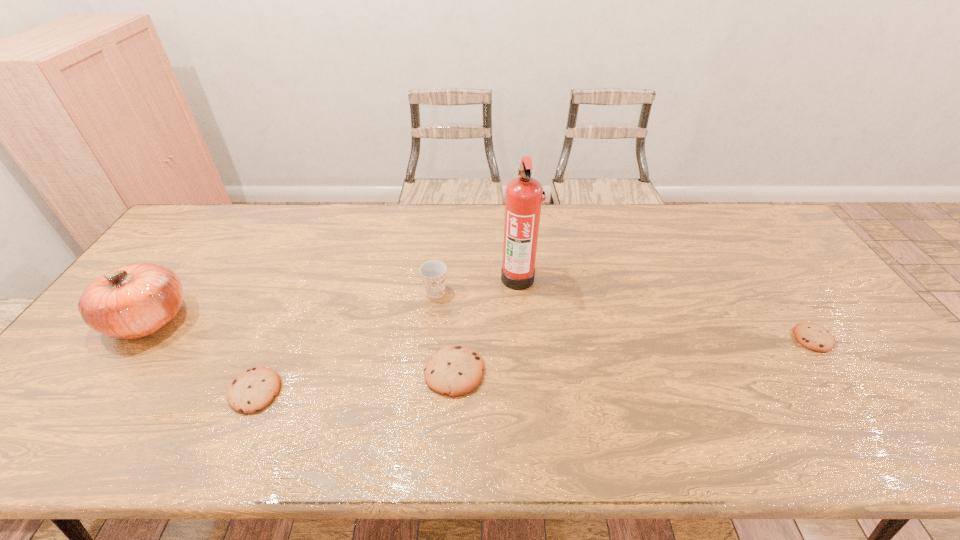
The height and width of the screenshot is (540, 960). What are the coordinates of `vacant space that's between the leftmost object and the second shortest cookie` in the screenshot? It's located at (202, 355).

Where is `unoccupied area between the pumpkin and the Dixie cup`? unoccupied area between the pumpkin and the Dixie cup is located at coordinates (292, 306).

Where is `free space between the second tallest cookie and the tallest object`? free space between the second tallest cookie and the tallest object is located at coordinates (387, 334).

Image resolution: width=960 pixels, height=540 pixels. Identify the location of free space between the Dixie cup and the fire extinguisher. (477, 285).

Locate an element on the screen. vacant point located between the shortest object and the Dixie cup is located at coordinates (624, 315).

I want to click on empty space that is in between the fifth tallest object and the fourth shortest object, so click(x=346, y=342).

Identify which object is located as the fourth nearest to the fifth shortest object. Please provide its 2D coordinates. Your answer should be formatted as a tuple, i.e. [(x, y)], where the tuple contains the x and y coordinates of a point satisfying the conditions above.

[(523, 200)]

Identify the location of the second closest object to the second shortest cookie. This screenshot has width=960, height=540. (455, 370).

Identify the location of cookie identified as the second closest to the tallest object. click(254, 389).

Identify the location of the closest cookie relative to the leftmost cookie. The height and width of the screenshot is (540, 960). (455, 370).